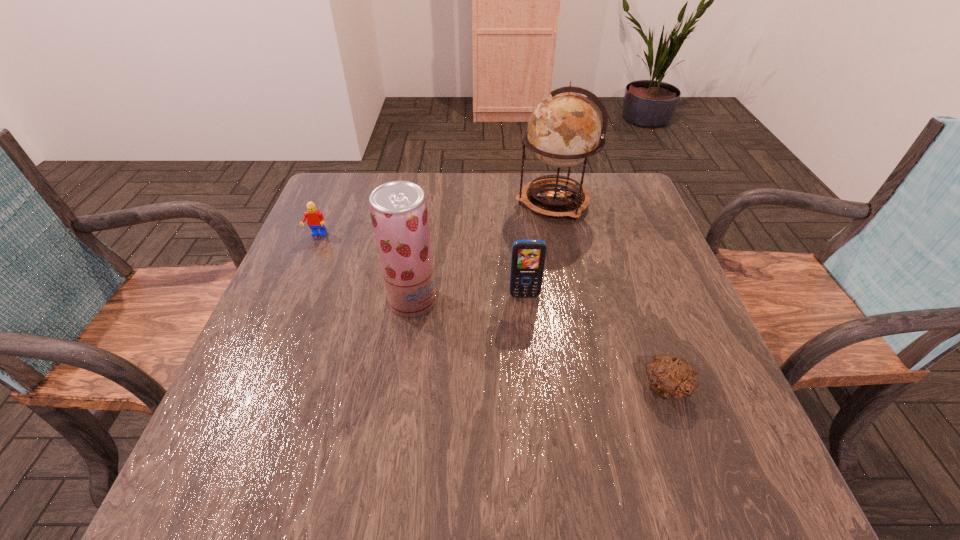
Where is `object present at the far right corner`? The image size is (960, 540). object present at the far right corner is located at coordinates (564, 129).

Image resolution: width=960 pixels, height=540 pixels. What are the coordinates of `free space at the far edge of the desktop` in the screenshot? It's located at (415, 175).

At what (x,y) coordinates should I click in order to perform the action: click on vacant space at the near edge of the desktop. Please return your answer as a coordinate pair (x, y). The image size is (960, 540). Looking at the image, I should click on (623, 461).

Find the location of `free space at the left edge`. free space at the left edge is located at coordinates (275, 301).

You are a GUI agent. You are given a task and a screenshot of the screen. Output one action in this format:
    pyautogui.click(x=<x>, y=<y>)
    Task: Click on the vacant space at the right edge of the desktop
    The image size is (960, 540).
    Given the screenshot: What is the action you would take?
    pyautogui.click(x=618, y=235)

Find the location of `free spot at the far left corner of the desktop`. free spot at the far left corner of the desktop is located at coordinates (347, 189).

The image size is (960, 540). I want to click on free spot between the leftmost object and the tallest object, so click(435, 219).

Locate an element on the screen. Image resolution: width=960 pixels, height=540 pixels. free space that is in between the tallest object and the second tallest object is located at coordinates (483, 252).

Locate an element on the screen. This screenshot has height=540, width=960. free space between the farthest object and the second object from left to right is located at coordinates (483, 252).

The width and height of the screenshot is (960, 540). I want to click on empty space between the second tallest object and the second shortest object, so click(x=365, y=268).